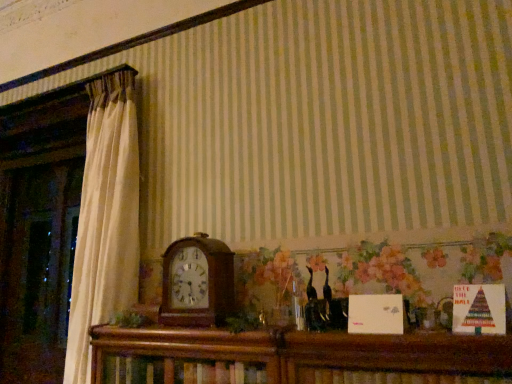
Identify the location of wooden clock at center. (197, 282).

The height and width of the screenshot is (384, 512). Describe the element at coordinates (197, 282) in the screenshot. I see `wooden clock at center` at that location.

Locate an element on the screen. This screenshot has width=512, height=384. wooden clock at center is located at coordinates (197, 282).